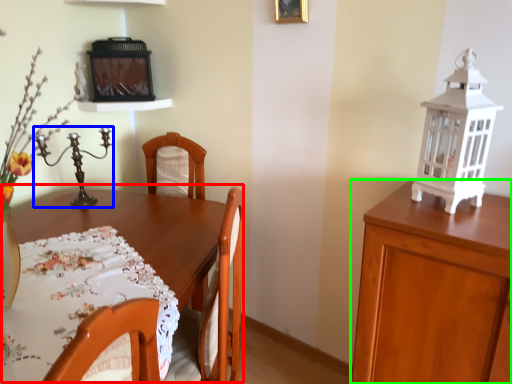
Question: Which object is the farthest from table (highlighted by a red box)? Choose among these: candle holder (highlighted by a blue box) or cabinetry (highlighted by a green box).

Choices:
 (A) candle holder
 (B) cabinetry

Answer: (B)